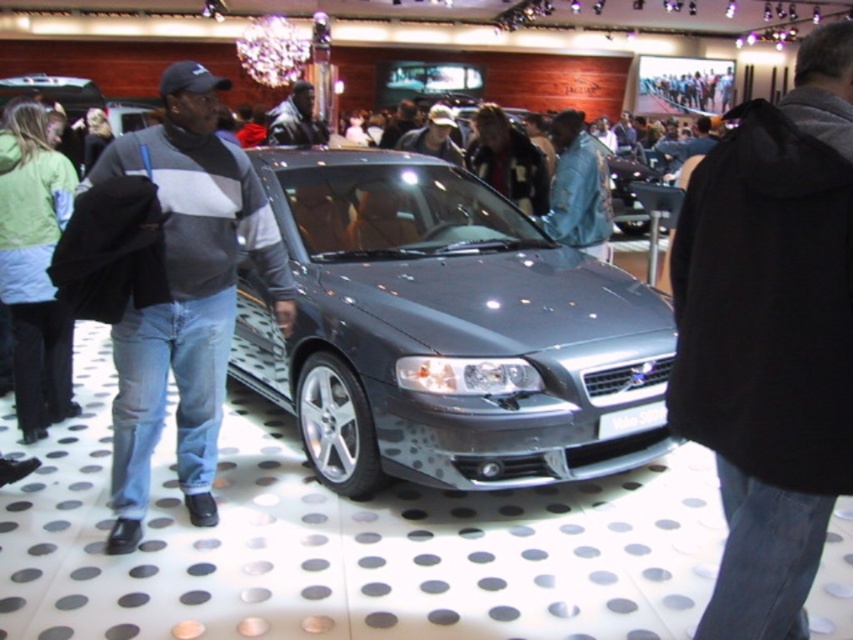
From the picture: Can you confirm if gray sweater at center is wider than white plastic license plate at center?

Yes, gray sweater at center is wider than white plastic license plate at center.

This screenshot has height=640, width=853. What are the coordinates of `gray sweater at center` in the screenshot? It's located at (186, 296).

Measure the distance between point (685, 269) and camera.

Point (685, 269) and camera are 7.03 feet apart from each other.

Can you confirm if black fabric jacket at center is shorter than leather jacket at center?

Incorrect, black fabric jacket at center's height does not fall short of leather jacket at center's.

Identify the location of black fabric jacket at center. This screenshot has height=640, width=853. 770,337.

Who is lower down, black fabric jacket at center or white plastic license plate at center?

Positioned lower is white plastic license plate at center.

Is black fabric jacket at center shorter than white plastic license plate at center?

No, black fabric jacket at center is not shorter than white plastic license plate at center.

Find the location of `black fabric jacket at center`. black fabric jacket at center is located at coordinates (770, 337).

In order to click on black fabric jacket at center in this screenshot , I will do `click(770, 337)`.